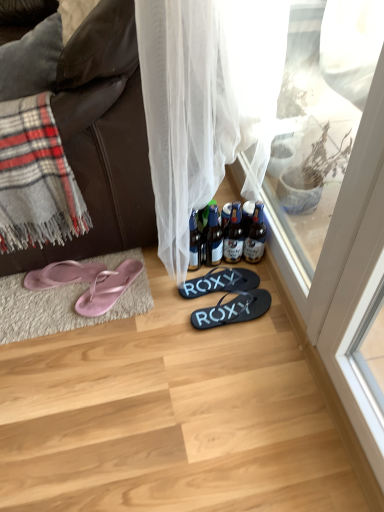
Question: Which direction should I rotate to look at black rubber flip flops at center, the third footwear when ordered from left to right, — up or down?

Choices:
 (A) up
 (B) down

Answer: (B)

Question: Is pink rubber flip-flops at lower left, which appears as the second footwear when viewed from the left, to the left of black rubber flip flops at center, acting as the 4th footwear starting from the left, from the viewer's perspective?

Choices:
 (A) yes
 (B) no

Answer: (A)

Question: From the image's perspective, is pink rubber flip-flops at lower left, the third footwear from the right, located above black rubber flip flops at center, which appears as the 1th footwear when viewed from the right?

Choices:
 (A) no
 (B) yes

Answer: (B)

Question: Is pink rubber flip-flops at lower left, the third footwear from the right, in contact with black rubber flip flops at center, acting as the 4th footwear starting from the left?

Choices:
 (A) no
 (B) yes

Answer: (A)

Question: From the image's perspective, does pink rubber flip-flops at lower left, the third footwear from the right, appear lower than black rubber flip flops at center, acting as the 4th footwear starting from the left?

Choices:
 (A) yes
 (B) no

Answer: (B)

Question: Are pink rubber flip-flops at lower left, the third footwear from the right, and black rubber flip flops at center, acting as the 4th footwear starting from the left, far apart?

Choices:
 (A) yes
 (B) no

Answer: (B)

Question: Does pink rubber flip-flops at lower left, the third footwear from the right, have a smaller size compared to black rubber flip flops at center, which appears as the 1th footwear when viewed from the right?

Choices:
 (A) yes
 (B) no

Answer: (A)

Question: Is gray plaid blanket at left taller than brown glass bottles at center, the 4th bottle in the left-to-right sequence?

Choices:
 (A) no
 (B) yes

Answer: (B)

Question: Is gray plaid blanket at left wider than brown glass bottles at center, which is the 1th bottle in right-to-left order?

Choices:
 (A) yes
 (B) no

Answer: (A)

Question: Is gray plaid blanket at left positioned behind brown glass bottles at center, the 4th bottle in the left-to-right sequence?

Choices:
 (A) yes
 (B) no

Answer: (B)

Question: Does gray plaid blanket at left have a lesser width compared to brown glass bottles at center, the 4th bottle in the left-to-right sequence?

Choices:
 (A) yes
 (B) no

Answer: (B)

Question: Is gray plaid blanket at left oriented towards brown glass bottles at center, which is the 1th bottle in right-to-left order?

Choices:
 (A) yes
 (B) no

Answer: (B)

Question: Does gray plaid blanket at left have a smaller size compared to brown glass bottles at center, the 4th bottle in the left-to-right sequence?

Choices:
 (A) no
 (B) yes

Answer: (A)

Question: Is gray plaid blanket at left next to translucent glass bottle at center, the 4th bottle positioned from the right, and touching it?

Choices:
 (A) no
 (B) yes

Answer: (A)